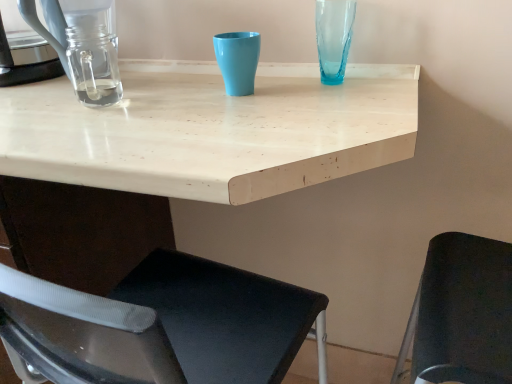
Question: Is clear glass jar at left smaller than black fabric chair at lower right?

Choices:
 (A) no
 (B) yes

Answer: (B)

Question: Considering the relative sizes of clear glass jar at left and black fabric chair at lower right in the image provided, is clear glass jar at left shorter than black fabric chair at lower right?

Choices:
 (A) no
 (B) yes

Answer: (B)

Question: From the image's perspective, would you say clear glass jar at left is shown under black fabric chair at lower right?

Choices:
 (A) yes
 (B) no

Answer: (B)

Question: Is clear glass jar at left completely or partially outside of black fabric chair at lower right?

Choices:
 (A) no
 (B) yes

Answer: (B)

Question: Does clear glass jar at left appear on the left side of black fabric chair at lower right?

Choices:
 (A) yes
 (B) no

Answer: (A)

Question: Is clear glass jar at left positioned with its back to black fabric chair at lower right?

Choices:
 (A) yes
 (B) no

Answer: (B)

Question: Is matte plastic cup at center at the right side of white matte table at center?

Choices:
 (A) yes
 (B) no

Answer: (A)

Question: Does matte plastic cup at center have a greater width compared to white matte table at center?

Choices:
 (A) yes
 (B) no

Answer: (B)

Question: Considering the relative sizes of matte plastic cup at center and white matte table at center in the image provided, is matte plastic cup at center smaller than white matte table at center?

Choices:
 (A) yes
 (B) no

Answer: (A)

Question: From a real-world perspective, is matte plastic cup at center positioned over white matte table at center based on gravity?

Choices:
 (A) yes
 (B) no

Answer: (A)

Question: Is matte plastic cup at center far from white matte table at center?

Choices:
 (A) yes
 (B) no

Answer: (B)

Question: Is white matte table at center located within matte plastic cup at center?

Choices:
 (A) no
 (B) yes

Answer: (A)

Question: Is translucent blue glass vase at upper right not within clear glass coffeepot at left?

Choices:
 (A) no
 (B) yes

Answer: (B)